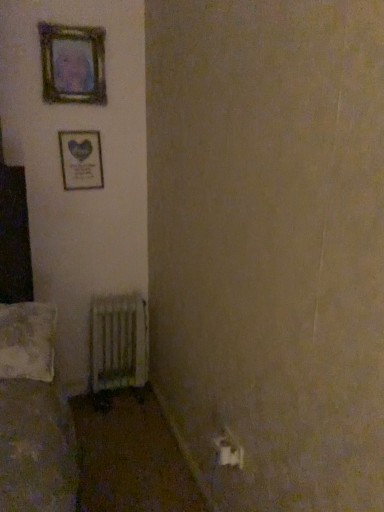
You are a GUI agent. You are given a task and a screenshot of the screen. Output one action in this format:
    pyautogui.click(x=<x>, y=<y>)
    Task: Click on the white plastic electric outlet at lower right
    The height and width of the screenshot is (512, 384).
    Given the screenshot: What is the action you would take?
    pyautogui.click(x=228, y=449)

What is the approximate width of metallic radiator at lower left?

It is 10.15 centimeters.

Measure the distance between point (6, 367) and camera.

The depth of point (6, 367) is 1.64 meters.

Find the location of `white plastic electric outlet at lower right`. white plastic electric outlet at lower right is located at coordinates (228, 449).

Is wooden frame at upper left, the 2th picture frame in the bottom-to-top sequence, not near white textured pillow at lower left?

Yes, wooden frame at upper left, the 2th picture frame in the bottom-to-top sequence, and white textured pillow at lower left are quite far apart.

Can you confirm if wooden frame at upper left, the first picture frame from the top, is positioned to the right of white textured pillow at lower left?

Correct, you'll find wooden frame at upper left, the first picture frame from the top, to the right of white textured pillow at lower left.

Does wooden frame at upper left, the first picture frame from the top, have a smaller size compared to white textured pillow at lower left?

Indeed, wooden frame at upper left, the first picture frame from the top, has a smaller size compared to white textured pillow at lower left.

Considering the sizes of objects wooden frame at upper left, which ranks as the 1th picture frame in bottom-to-top order, and wooden frame at upper left, the first picture frame from the top, in the image provided, who is thinner, wooden frame at upper left, which ranks as the 1th picture frame in bottom-to-top order, or wooden frame at upper left, the first picture frame from the top,?

wooden frame at upper left, which ranks as the 1th picture frame in bottom-to-top order.

Is the depth of wooden frame at upper left, placed as the second picture frame when sorted from top to bottom, greater than that of wooden frame at upper left, the first picture frame from the top?

That is True.

From a real-world perspective, between wooden frame at upper left, which ranks as the 1th picture frame in bottom-to-top order, and wooden frame at upper left, the first picture frame from the top, who is vertically higher?

In real-world perspective, wooden frame at upper left, the first picture frame from the top, is above.

Considering the sizes of objects white plastic electric outlet at lower right and wooden frame at upper left, the first picture frame from the top, in the image provided, who is smaller, white plastic electric outlet at lower right or wooden frame at upper left, the first picture frame from the top,?

With smaller size is white plastic electric outlet at lower right.

Can you see white plastic electric outlet at lower right touching wooden frame at upper left, the first picture frame from the top?

No, white plastic electric outlet at lower right is not in contact with wooden frame at upper left, the first picture frame from the top.

Where is `the 1st picture frame behind when counting from the white plastic electric outlet at lower right`? The height and width of the screenshot is (512, 384). the 1st picture frame behind when counting from the white plastic electric outlet at lower right is located at coordinates (73, 64).

Which object is thinner, white plastic electric outlet at lower right or metallic radiator at lower left?

white plastic electric outlet at lower right is thinner.

Is white plastic electric outlet at lower right to the right of metallic radiator at lower left from the viewer's perspective?

Yes.

Considering the positions of points (239, 453) and (146, 378), is point (239, 453) farther from camera compared to point (146, 378)?

No, (239, 453) is in front of (146, 378).

From the image's perspective, is white plastic electric outlet at lower right located above or below metallic radiator at lower left?

Based on their image positions, white plastic electric outlet at lower right is located beneath metallic radiator at lower left.

Considering the sizes of objects white textured pillow at lower left and white plastic electric outlet at lower right in the image provided, who is taller, white textured pillow at lower left or white plastic electric outlet at lower right?

With more height is white textured pillow at lower left.

From a real-world perspective, is white textured pillow at lower left located higher than white plastic electric outlet at lower right?

Indeed, from a real-world perspective, white textured pillow at lower left stands above white plastic electric outlet at lower right.

Does point (106, 309) come closer to viewer compared to point (83, 174)?

That is False.

Is metallic radiator at lower left placed right next to wooden frame at upper left, placed as the second picture frame when sorted from top to bottom?

No.

Locate an element on the screen. The width and height of the screenshot is (384, 512). radiator below the wooden frame at upper left, placed as the second picture frame when sorted from top to bottom (from a real-world perspective) is located at coordinates (118, 342).

How different are the orientations of metallic radiator at lower left and wooden frame at upper left, which ranks as the 1th picture frame in bottom-to-top order, in degrees?

metallic radiator at lower left and wooden frame at upper left, which ranks as the 1th picture frame in bottom-to-top order, are facing 2.66 degrees away from each other.

Does metallic radiator at lower left have a greater height compared to white textured pillow at lower left?

Yes, metallic radiator at lower left is taller than white textured pillow at lower left.

From the image's perspective, between metallic radiator at lower left and white textured pillow at lower left, which one is located above?

From the image's view, white textured pillow at lower left is above.

Is metallic radiator at lower left aimed at white textured pillow at lower left?

No.

Looking at the image, does metallic radiator at lower left seem bigger or smaller compared to white textured pillow at lower left?

Considering their sizes, metallic radiator at lower left takes up less space than white textured pillow at lower left.

In the image, there is a wooden frame at upper left, the 2th picture frame in the bottom-to-top sequence. Find the location of `pillow below it (from the image's perspective)`. pillow below it (from the image's perspective) is located at coordinates (27, 341).

Locate an element on the screen. This screenshot has width=384, height=512. picture frame located on the left of wooden frame at upper left, which ranks as the 1th picture frame in bottom-to-top order is located at coordinates (73, 64).

Based on the photo, looking at the image, which one is located closer to white textured pillow at lower left, white plastic electric outlet at lower right or metallic radiator at lower left?

metallic radiator at lower left is positioned closer to the anchor white textured pillow at lower left.

Considering their positions, is wooden frame at upper left, the first picture frame from the top, positioned closer to white textured pillow at lower left than white plastic electric outlet at lower right?

The object closer to white textured pillow at lower left is white plastic electric outlet at lower right.

Considering their positions, is metallic radiator at lower left positioned further to wooden frame at upper left, which ranks as the 1th picture frame in bottom-to-top order, than white plastic electric outlet at lower right?

white plastic electric outlet at lower right.

Based on their spatial positions, is white plastic electric outlet at lower right or wooden frame at upper left, which ranks as the 1th picture frame in bottom-to-top order, closer to wooden frame at upper left, the first picture frame from the top?

wooden frame at upper left, which ranks as the 1th picture frame in bottom-to-top order, is closer to wooden frame at upper left, the first picture frame from the top.

Based on their spatial positions, is wooden frame at upper left, the 2th picture frame in the bottom-to-top sequence, or metallic radiator at lower left further from white plastic electric outlet at lower right?

Based on the image, wooden frame at upper left, the 2th picture frame in the bottom-to-top sequence, appears to be further to white plastic electric outlet at lower right.

Looking at the image, which one is located closer to white textured pillow at lower left, wooden frame at upper left, placed as the second picture frame when sorted from top to bottom, or wooden frame at upper left, the first picture frame from the top?

wooden frame at upper left, placed as the second picture frame when sorted from top to bottom, lies closer to white textured pillow at lower left than the other object.

Looking at the image, which one is located closer to white plastic electric outlet at lower right, metallic radiator at lower left or wooden frame at upper left, the first picture frame from the top?

Based on the image, metallic radiator at lower left appears to be nearer to white plastic electric outlet at lower right.

When comparing their distances from wooden frame at upper left, placed as the second picture frame when sorted from top to bottom, does white plastic electric outlet at lower right or wooden frame at upper left, the first picture frame from the top, seem further?

white plastic electric outlet at lower right is positioned further to the anchor wooden frame at upper left, placed as the second picture frame when sorted from top to bottom.

At what (x,y) coordinates should I click in order to perform the action: click on picture frame that lies between wooden frame at upper left, the first picture frame from the top, and white textured pillow at lower left from top to bottom. Please return your answer as a coordinate pair (x, y). Looking at the image, I should click on (81, 160).

This screenshot has width=384, height=512. I want to click on pillow between wooden frame at upper left, the 2th picture frame in the bottom-to-top sequence, and metallic radiator at lower left in the up-down direction, so click(27, 341).

The image size is (384, 512). Identify the location of radiator between wooden frame at upper left, which ranks as the 1th picture frame in bottom-to-top order, and white plastic electric outlet at lower right in the up-down direction. (118, 342).

In order to click on radiator between wooden frame at upper left, the 2th picture frame in the bottom-to-top sequence, and white plastic electric outlet at lower right vertically in this screenshot , I will do 118,342.